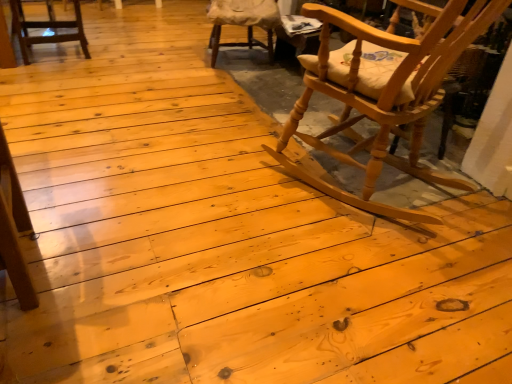
Find the location of a particular element. Image resolution: width=512 pixels, height=384 pixels. empty space that is in between matte wood chair at upper left, the 2th chair in the front-to-back sequence, and natural wood rocking chair at right, which is the 3th chair from back to front is located at coordinates (170, 100).